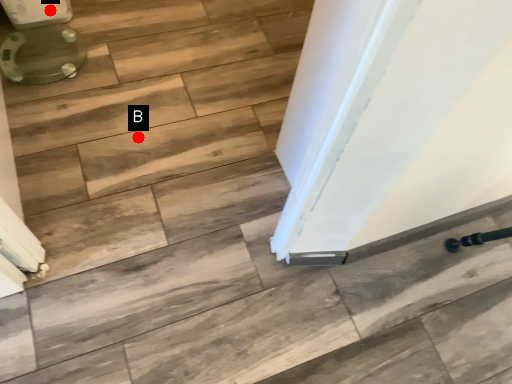
Question: Two points are circled on the image, labeled by A and B beside each circle. Which point is closer to the camera?

Choices:
 (A) A is closer
 (B) B is closer

Answer: (B)